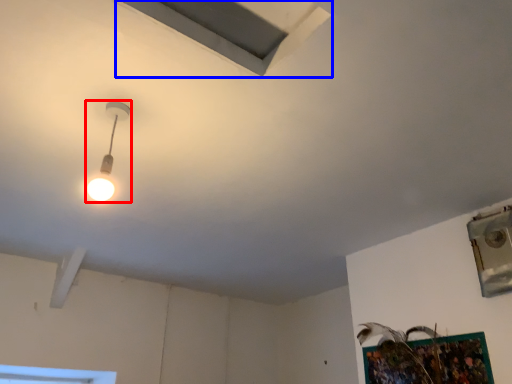
Question: Which object appears closest to the camera in this image, lamp (highlighted by a red box) or exhaust hood (highlighted by a blue box)?

Choices:
 (A) lamp
 (B) exhaust hood

Answer: (B)